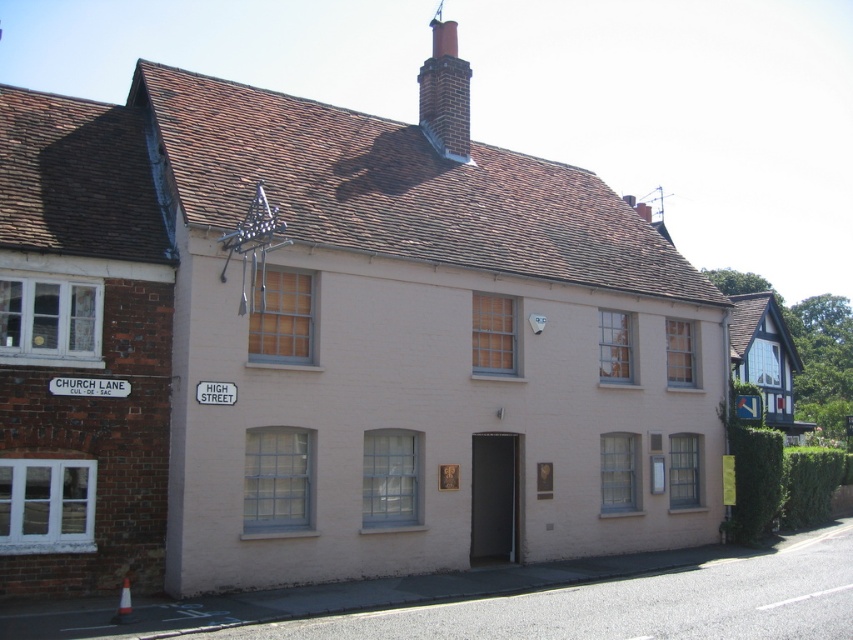
From the picture: Can you confirm if brick chimney at upper center is positioned to the right of white plastic street sign at upper left?

Indeed, brick chimney at upper center is positioned on the right side of white plastic street sign at upper left.

Does point (444, 147) come behind point (114, 388)?

Yes.

Find the location of a particular element. brick chimney at upper center is located at coordinates (445, 93).